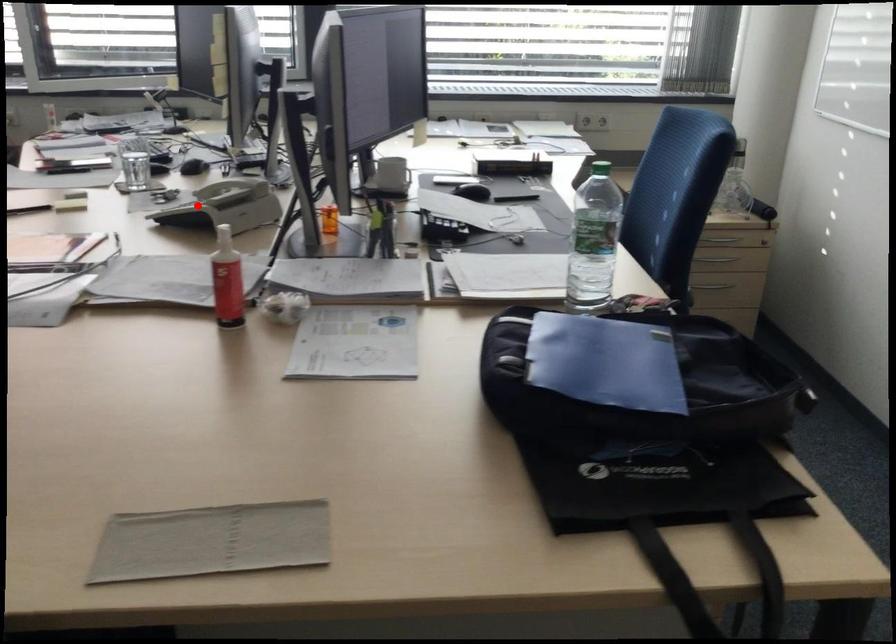
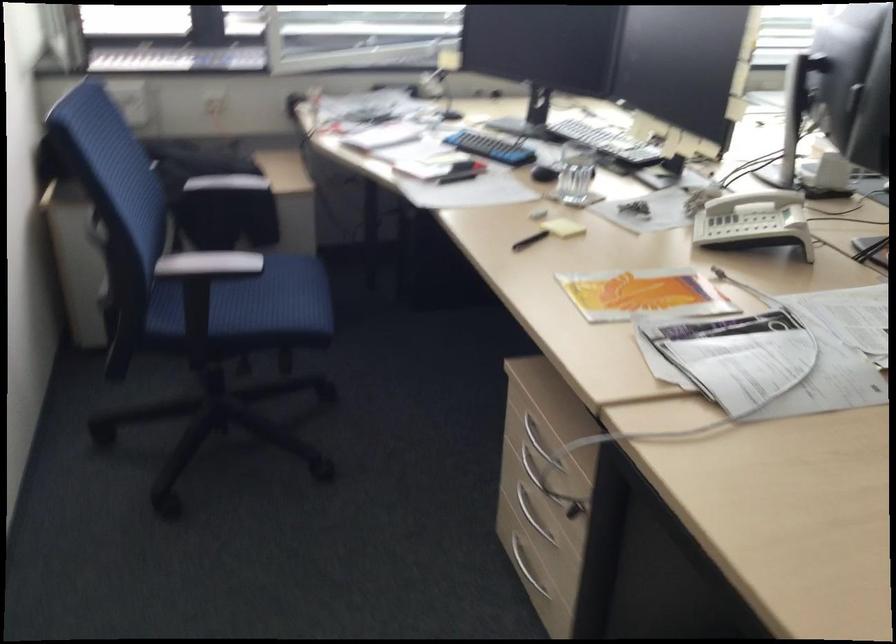
The point at the highlighted location is marked in the first image. Where is the corresponding point in the second image?

(751, 225)